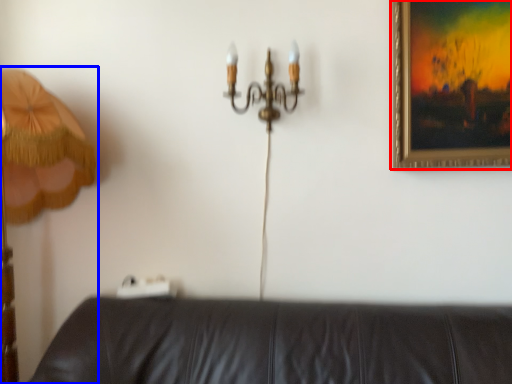
Question: Among these objects, which one is farthest to the camera, picture frame (highlighted by a red box) or lamp (highlighted by a blue box)?

Choices:
 (A) picture frame
 (B) lamp

Answer: (A)